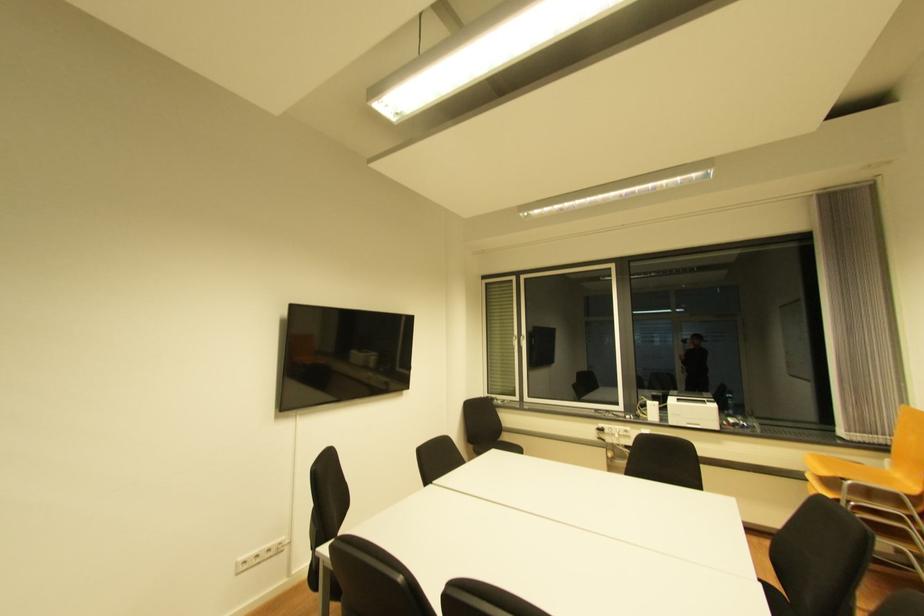
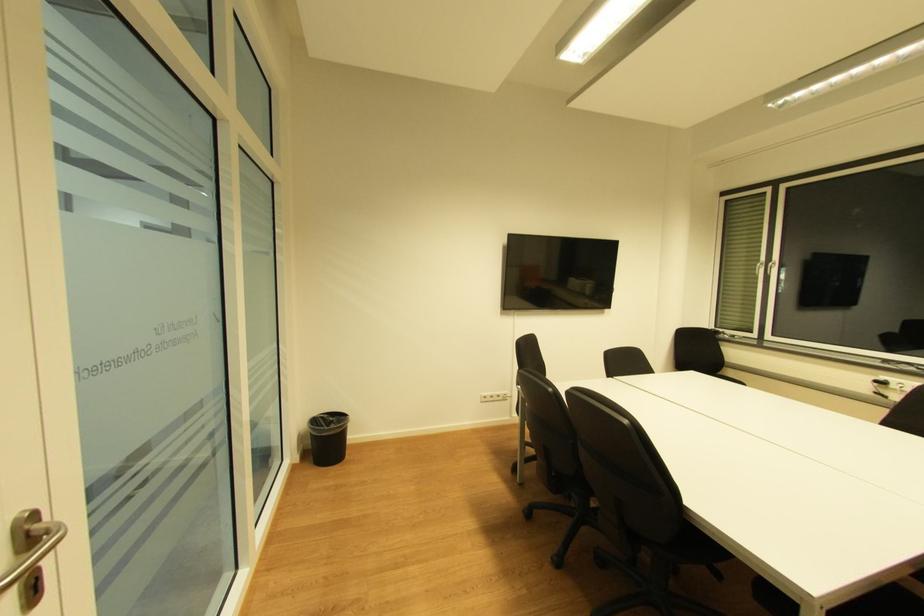
Question: The first image is from the beginning of the video and the second image is from the end. How did the camera likely rotate when shooting the video?

Choices:
 (A) Left
 (B) Right
 (C) Up
 (D) Down

Answer: (A)